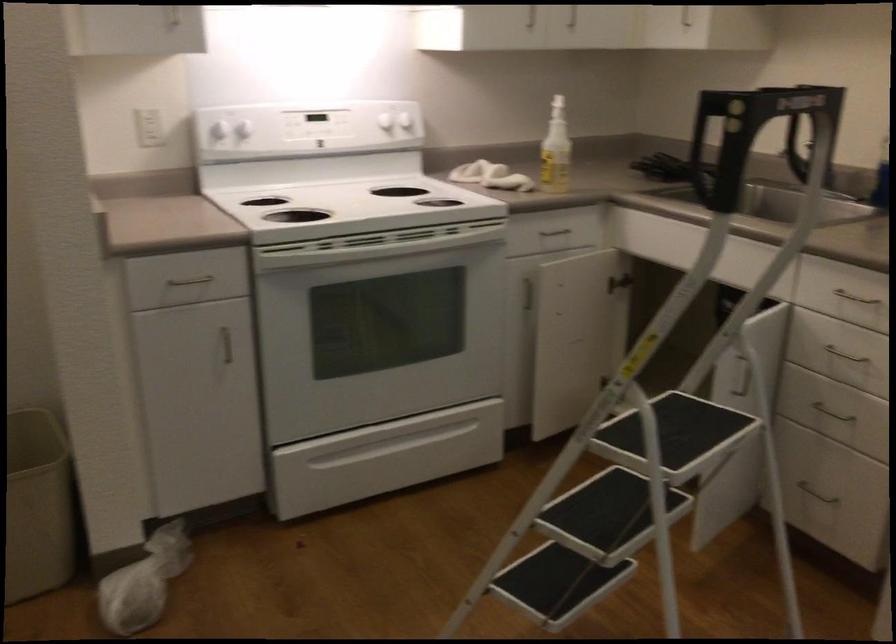
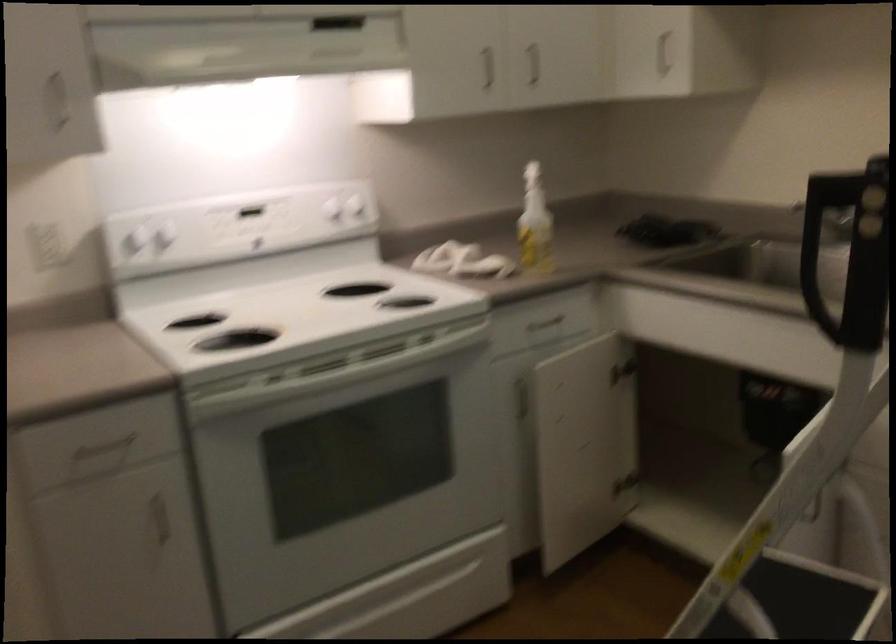
Where in the second image is the point corresponding to point (239, 124) from the first image?

(165, 238)